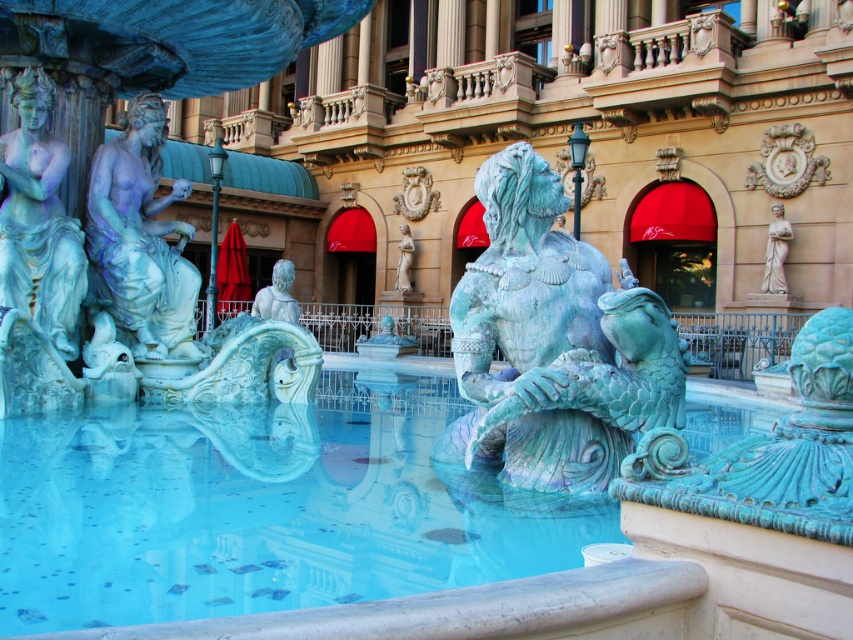
Does green patina sculpture at center have a smaller size compared to green patina statue at center?

Correct, green patina sculpture at center occupies less space than green patina statue at center.

In order to click on green patina sculpture at center in this screenshot , I will do `click(553, 342)`.

Is point (80, 422) positioned after point (73, 227)?

No.

Is the position of turquoise stone fountain at center less distant than that of matte blue statue at left?

Yes, it is.

Identify the location of turquoise stone fountain at center. The width and height of the screenshot is (853, 640). (260, 508).

Between green patina statue at center and white marble statue at center, which one appears on the left side from the viewer's perspective?

Positioned to the left is green patina statue at center.

The height and width of the screenshot is (640, 853). What do you see at coordinates (277, 296) in the screenshot?
I see `green patina statue at center` at bounding box center [277, 296].

This screenshot has height=640, width=853. What are the coordinates of `green patina statue at center` in the screenshot? It's located at (277, 296).